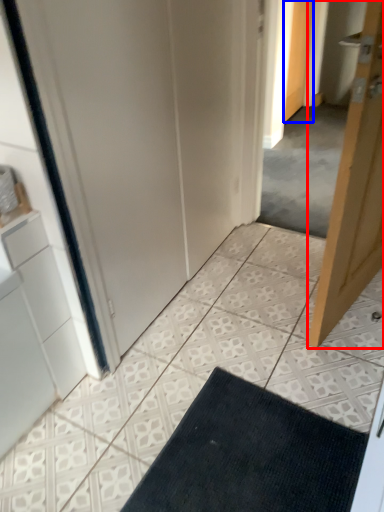
Question: Which of the following is the farthest to the observer, door (highlighted by a red box) or door (highlighted by a blue box)?

Choices:
 (A) door
 (B) door

Answer: (B)